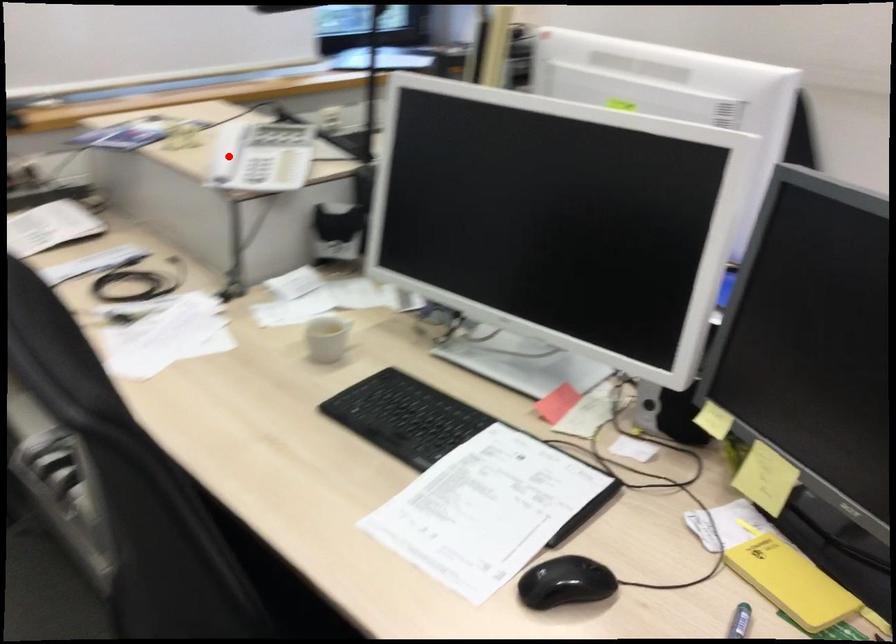
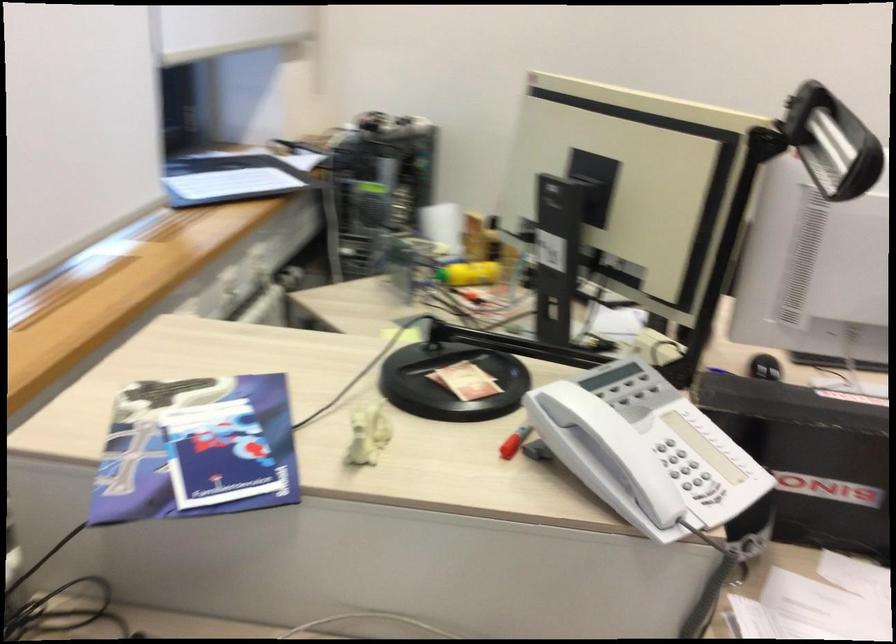
The point at the highlighted location is marked in the first image. Where is the corresponding point in the second image?

(513, 442)